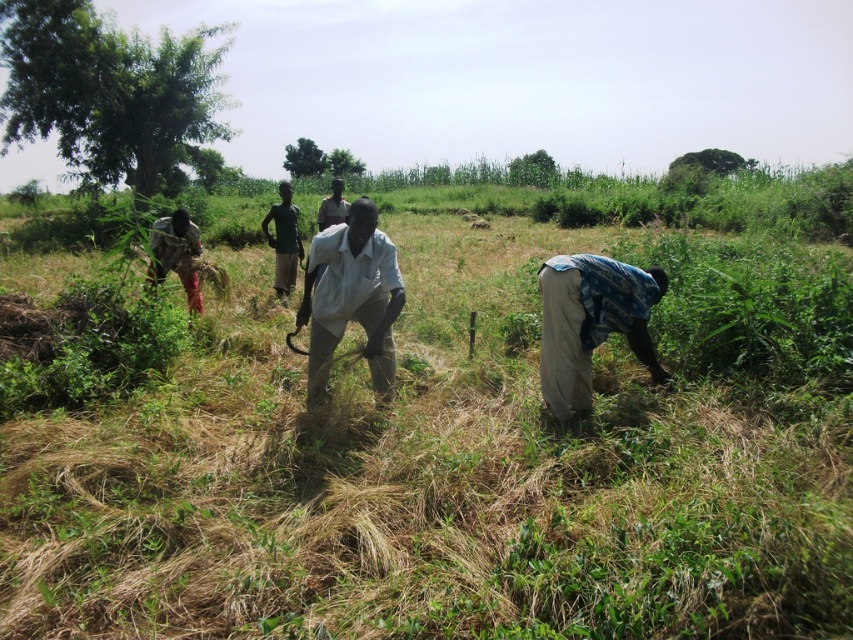
Which is below, dry grass at center or blue-patterned fabric at lower right?

blue-patterned fabric at lower right is lower down.

Is dry grass at center positioned at the back of blue-patterned fabric at lower right?

No, dry grass at center is closer to the viewer.

What do you see at coordinates (428, 445) in the screenshot? I see `dry grass at center` at bounding box center [428, 445].

Identify the location of dry grass at center. The height and width of the screenshot is (640, 853). (428, 445).

Which of these two, blue-patterned fabric at lower right or camouflage fabric shirt at left, stands taller?

Standing taller between the two is blue-patterned fabric at lower right.

Who is positioned more to the right, blue-patterned fabric at lower right or camouflage fabric shirt at left?

blue-patterned fabric at lower right is more to the right.

Where is `blue-patterned fabric at lower right`? The width and height of the screenshot is (853, 640). blue-patterned fabric at lower right is located at coordinates (590, 323).

Can you confirm if white cotton shirt at center is smaller than light gray shirt at center?

Yes.

What do you see at coordinates (351, 298) in the screenshot? Image resolution: width=853 pixels, height=640 pixels. I see `white cotton shirt at center` at bounding box center [351, 298].

Find the location of a particular element. white cotton shirt at center is located at coordinates (351, 298).